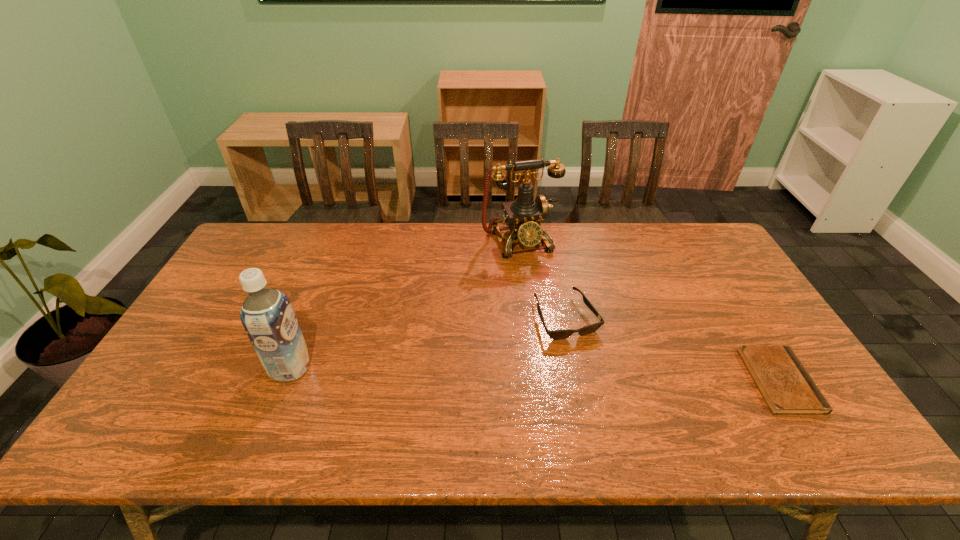
Where is `vacant space at the far edge`? This screenshot has width=960, height=540. vacant space at the far edge is located at coordinates (399, 248).

In the image, there is a desktop. Where is `vacant region at the near edge`? Image resolution: width=960 pixels, height=540 pixels. vacant region at the near edge is located at coordinates (300, 393).

Locate an element on the screen. The height and width of the screenshot is (540, 960). free space at the near left corner is located at coordinates (181, 408).

In the image, there is a desktop. What are the coordinates of `free space at the far right corner` in the screenshot? It's located at (696, 254).

Find the location of `free space between the telephone and the third nearest object`. free space between the telephone and the third nearest object is located at coordinates (543, 280).

This screenshot has width=960, height=540. Identify the location of vacant point located between the leftmost object and the shortest object. (536, 374).

Image resolution: width=960 pixels, height=540 pixels. Identify the location of empty location between the telephone and the leftmost object. (405, 305).

This screenshot has height=540, width=960. Identify the location of free area in between the leftmost object and the second farthest object. (428, 343).

The height and width of the screenshot is (540, 960). Find the location of `free space that is in between the second shortest object and the farthest object`. free space that is in between the second shortest object and the farthest object is located at coordinates (543, 280).

The image size is (960, 540). Find the location of `empty space that is in between the diary and the sunglasses`. empty space that is in between the diary and the sunglasses is located at coordinates (673, 349).